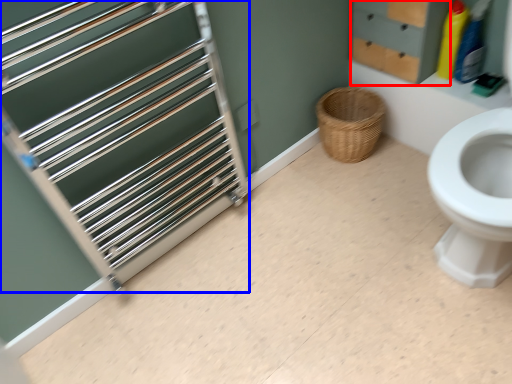
Question: Among these objects, which one is farthest to the camera, drawer (highlighted by a red box) or cage (highlighted by a blue box)?

Choices:
 (A) drawer
 (B) cage

Answer: (A)